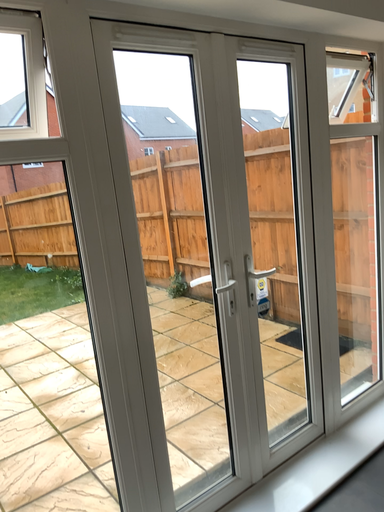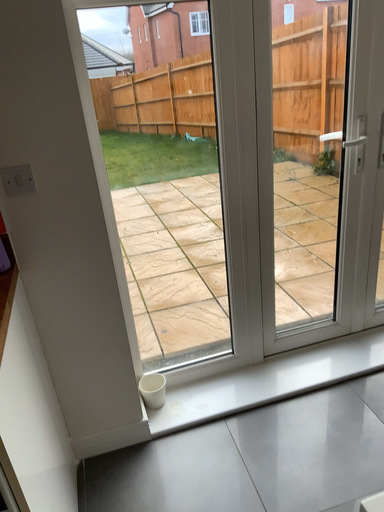
Question: Which way did the camera rotate in the video?

Choices:
 (A) rotated right
 (B) rotated left

Answer: (B)